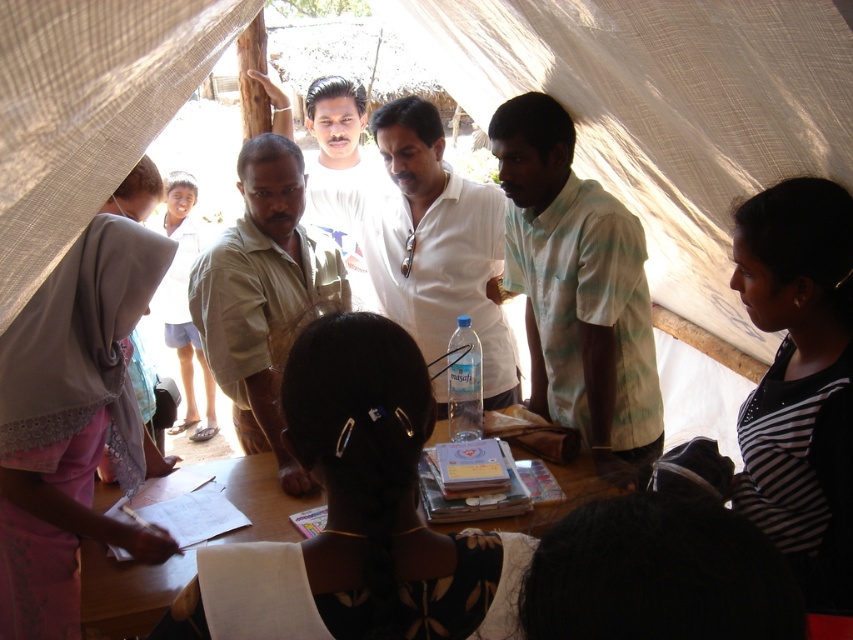
You are a photographer standing at the back of the tent. You want to take a photo of the white matte shirt at center and the wooden table at center. Which object will appear larger in the photo?

The white matte shirt at center will appear larger in the photo because it is taller than the wooden table at center.